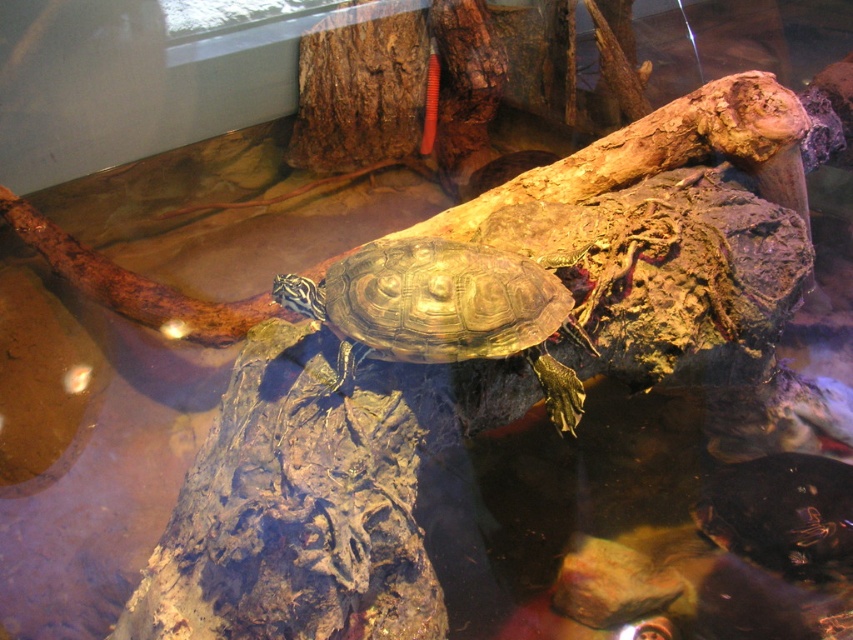
You are a new turtle in the terrarium and want to reach the shiny dark green tortoise at center. Which direction should you move from the shiny brown tortoise at center?

The shiny brown tortoise at center is in front of the shiny dark green tortoise at center, so to reach the shiny dark green tortoise at center, you should move backward from the shiny brown tortoise at center.

You are a caretaker who needs to ensure each turtle has enough space in the terrarium. Given the two shiny brown tortoise at center and shiny dark green tortoise at center, which one requires a larger area due to its size?

The shiny brown tortoise at center requires a larger area because its width is greater than the shiny dark green tortoise at center.